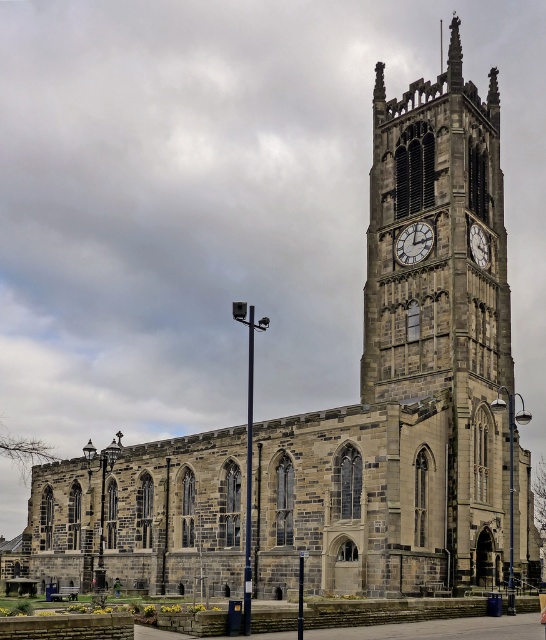
Question: Is dark gray stone clock tower at center wider than stone clock tower at upper center?

Choices:
 (A) yes
 (B) no

Answer: (A)

Question: Is dark gray stone clock tower at center behind stone clock tower at upper center?

Choices:
 (A) no
 (B) yes

Answer: (A)

Question: Which point appears farthest from the camera in this image?

Choices:
 (A) (399, 248)
 (B) (477, 236)
 (C) (537, 556)

Answer: (A)

Question: Which of the following is the farthest from the observer?

Choices:
 (A) (466, 257)
 (B) (473, 246)

Answer: (B)

Question: Does dark gray stone clock tower at center appear on the left side of stone clock tower at center?

Choices:
 (A) yes
 (B) no

Answer: (B)

Question: Which of the following is the closest to the observer?

Choices:
 (A) (375, 332)
 (B) (426, 240)
 (C) (476, 228)

Answer: (B)